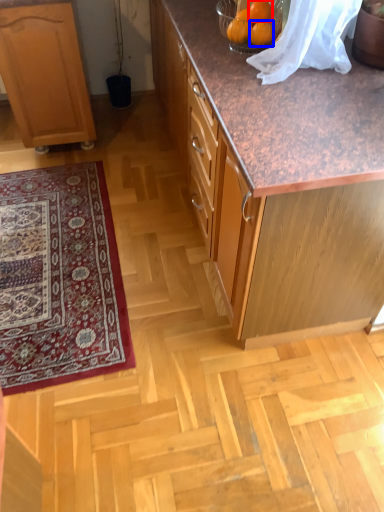
Question: Which point is further to the camera, orange (highlighted by a red box) or orange (highlighted by a blue box)?

Choices:
 (A) orange
 (B) orange

Answer: (A)